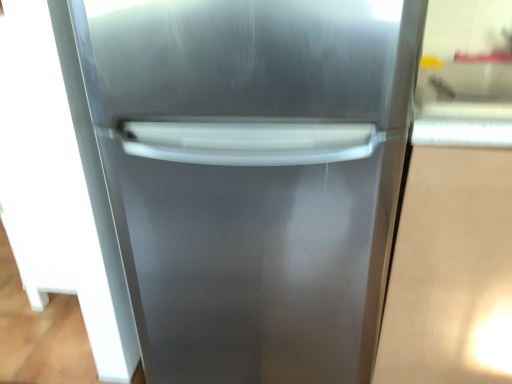
At what (x,y) coordinates should I click in order to perform the action: click on polished silver refrigerator door at left. Please return your answer as a coordinate pair (x, y). This screenshot has height=384, width=512. Looking at the image, I should click on (59, 182).

The image size is (512, 384). Describe the element at coordinates (59, 182) in the screenshot. I see `polished silver refrigerator door at left` at that location.

Where is `stainless steel refrigerator at center`? This screenshot has height=384, width=512. stainless steel refrigerator at center is located at coordinates (253, 176).

Describe the element at coordinates (253, 176) in the screenshot. The width and height of the screenshot is (512, 384). I see `stainless steel refrigerator at center` at that location.

I want to click on polished silver refrigerator door at left, so click(x=59, y=182).

Is polished silver refrigerator door at left to the right of stainless steel refrigerator at center from the viewer's perspective?

No.

Consider the image. Considering the relative positions of polished silver refrigerator door at left and stainless steel refrigerator at center in the image provided, is polished silver refrigerator door at left behind stainless steel refrigerator at center?

Yes, the depth of polished silver refrigerator door at left is greater than that of stainless steel refrigerator at center.

Between point (86, 203) and point (161, 288), which one is positioned behind?

The point (86, 203) is farther from the camera.

Consider the image. From the image's perspective, relative to stainless steel refrigerator at center, is polished silver refrigerator door at left above or below?

From the image's perspective, polished silver refrigerator door at left appears above stainless steel refrigerator at center.

Based on the photo, from a real-world perspective, is polished silver refrigerator door at left above or below stainless steel refrigerator at center?

Clearly, from a real-world perspective, polished silver refrigerator door at left is below stainless steel refrigerator at center.

Does polished silver refrigerator door at left have a greater width compared to stainless steel refrigerator at center?

Incorrect, the width of polished silver refrigerator door at left does not surpass that of stainless steel refrigerator at center.

From their relative heights in the image, would you say polished silver refrigerator door at left is taller or shorter than stainless steel refrigerator at center?

Considering their sizes, polished silver refrigerator door at left has less height than stainless steel refrigerator at center.

In terms of size, does polished silver refrigerator door at left appear bigger or smaller than stainless steel refrigerator at center?

Clearly, polished silver refrigerator door at left is smaller in size than stainless steel refrigerator at center.

Is polished silver refrigerator door at left situated inside stainless steel refrigerator at center or outside?

polished silver refrigerator door at left is not enclosed by stainless steel refrigerator at center.

Is polished silver refrigerator door at left placed right next to stainless steel refrigerator at center?

There is a gap between polished silver refrigerator door at left and stainless steel refrigerator at center.

Is polished silver refrigerator door at left facing towards stainless steel refrigerator at center?

No, polished silver refrigerator door at left is not turned towards stainless steel refrigerator at center.

Where is `glass door above the stainless steel refrigerator at center (from the image's perspective)`? The height and width of the screenshot is (384, 512). glass door above the stainless steel refrigerator at center (from the image's perspective) is located at coordinates (59, 182).

Consider the image. Considering the relative positions of stainless steel refrigerator at center and polished silver refrigerator door at left in the image provided, is stainless steel refrigerator at center to the left of polished silver refrigerator door at left from the viewer's perspective?

No.

Considering their positions, is stainless steel refrigerator at center located in front of or behind polished silver refrigerator door at left?

In the image, stainless steel refrigerator at center appears in front of polished silver refrigerator door at left.

Is point (327, 178) farther from viewer compared to point (130, 331)?

No, (327, 178) is closer to viewer.

From the image's perspective, which object appears higher, stainless steel refrigerator at center or polished silver refrigerator door at left?

polished silver refrigerator door at left appears higher in the image.

Looking at this image, from a real-world perspective, which object rests below the other?

polished silver refrigerator door at left, from a real-world perspective.

Considering the sizes of objects stainless steel refrigerator at center and polished silver refrigerator door at left in the image provided, who is thinner, stainless steel refrigerator at center or polished silver refrigerator door at left?

polished silver refrigerator door at left.

Does stainless steel refrigerator at center have a lesser height compared to polished silver refrigerator door at left?

Incorrect, the height of stainless steel refrigerator at center does not fall short of that of polished silver refrigerator door at left.

Is stainless steel refrigerator at center bigger than polished silver refrigerator door at left?

Correct, stainless steel refrigerator at center is larger in size than polished silver refrigerator door at left.

Which is correct: stainless steel refrigerator at center is inside polished silver refrigerator door at left, or outside of it?

stainless steel refrigerator at center is not inside polished silver refrigerator door at left, it's outside.

Is stainless steel refrigerator at center beside polished silver refrigerator door at left?

No, stainless steel refrigerator at center is not making contact with polished silver refrigerator door at left.

Is stainless steel refrigerator at center positioned with its back to polished silver refrigerator door at left?

No, stainless steel refrigerator at center is not facing away from polished silver refrigerator door at left.

How many degrees apart are the facing directions of stainless steel refrigerator at center and polished silver refrigerator door at left?

stainless steel refrigerator at center and polished silver refrigerator door at left are facing 90.2 degrees away from each other.

Based on the photo, how much distance is there between stainless steel refrigerator at center and polished silver refrigerator door at left?

stainless steel refrigerator at center and polished silver refrigerator door at left are 12.80 inches apart from each other.

Where is `glass door on the left of stainless steel refrigerator at center`? This screenshot has height=384, width=512. glass door on the left of stainless steel refrigerator at center is located at coordinates (59, 182).

Locate an element on the screen. Image resolution: width=512 pixels, height=384 pixels. glass door that is under the stainless steel refrigerator at center (from a real-world perspective) is located at coordinates (59, 182).

At what (x,y) coordinates should I click in order to perform the action: click on refrigerator below the polished silver refrigerator door at left (from the image's perspective). Please return your answer as a coordinate pair (x, y). The image size is (512, 384). Looking at the image, I should click on (253, 176).